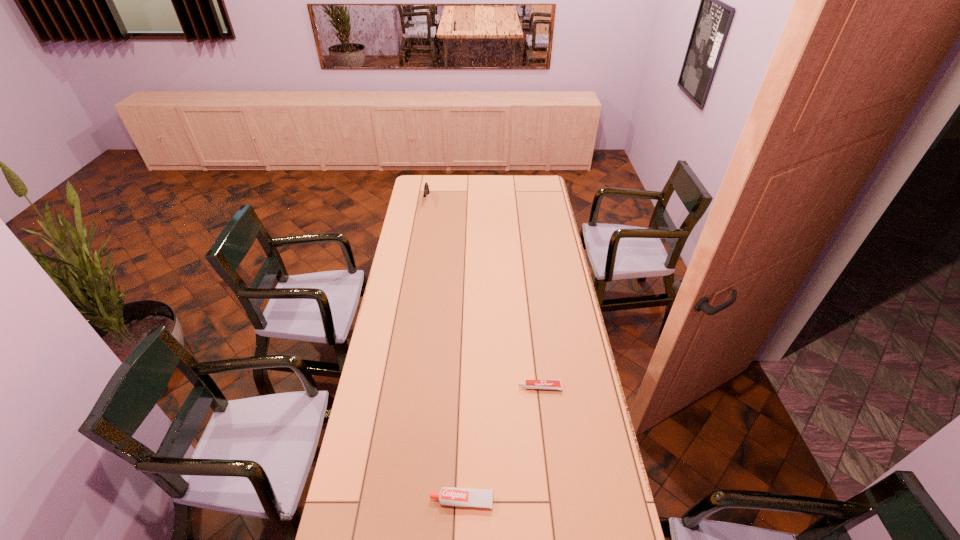
The image size is (960, 540). I want to click on vacant region located at the nozzle of the rightmost object, so click(448, 387).

The image size is (960, 540). Find the location of `object present at the far edge`. object present at the far edge is located at coordinates (426, 187).

Where is `object that is positioned at the left edge`? The height and width of the screenshot is (540, 960). object that is positioned at the left edge is located at coordinates (426, 187).

Find the location of a particular element. The height and width of the screenshot is (540, 960). object that is at the right edge is located at coordinates (554, 384).

Find the location of a particular element. The width and height of the screenshot is (960, 540). object at the far left corner is located at coordinates (426, 187).

This screenshot has height=540, width=960. In the image, there is a desktop. Find the location of `vacant space at the far edge`. vacant space at the far edge is located at coordinates (447, 175).

At what (x,y) coordinates should I click in order to perform the action: click on vacant space at the left edge of the desktop. Please return your answer as a coordinate pair (x, y). The height and width of the screenshot is (540, 960). Looking at the image, I should click on (419, 302).

Image resolution: width=960 pixels, height=540 pixels. Identify the location of blank space at the right edge of the desktop. (555, 298).

In the image, there is a desktop. In order to click on vacant space at the far left corner in this screenshot , I will do `click(418, 191)`.

You are a GUI agent. You are given a task and a screenshot of the screen. Output one action in this format:
    pyautogui.click(x=<x>, y=<y>)
    Task: Click on the vacant space at the far right corner
    
    Given the screenshot: What is the action you would take?
    click(534, 176)